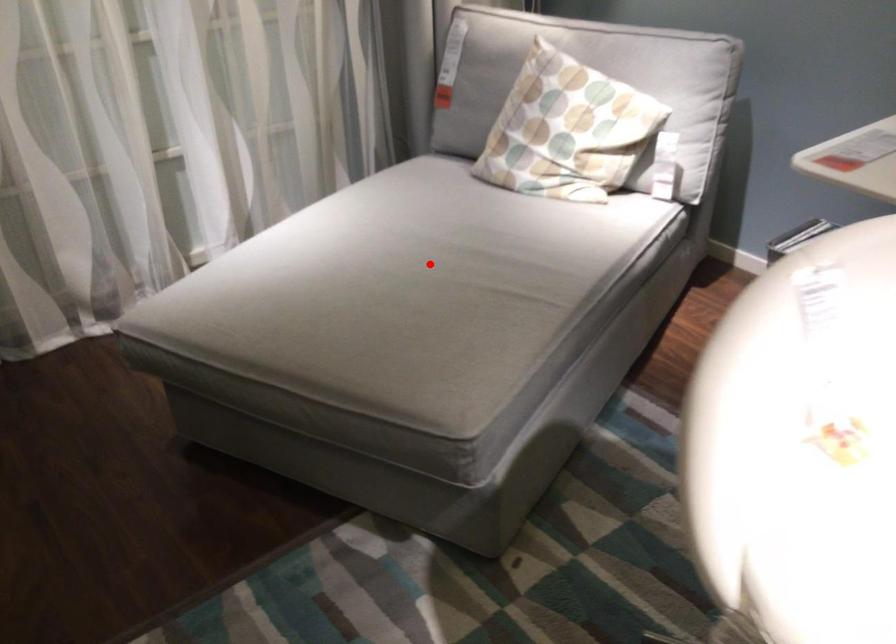
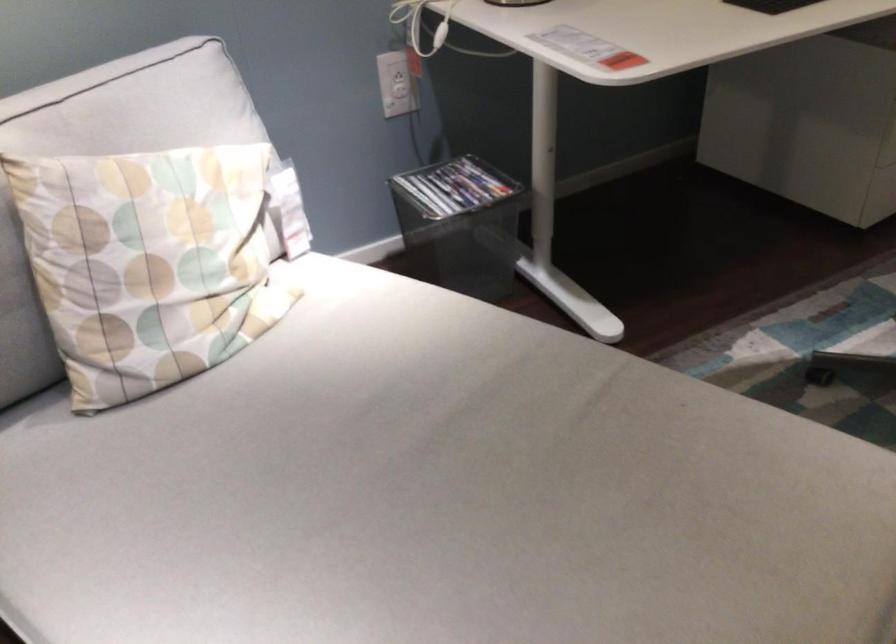
The point at the highlighted location is marked in the first image. Where is the corresponding point in the second image?

(438, 495)